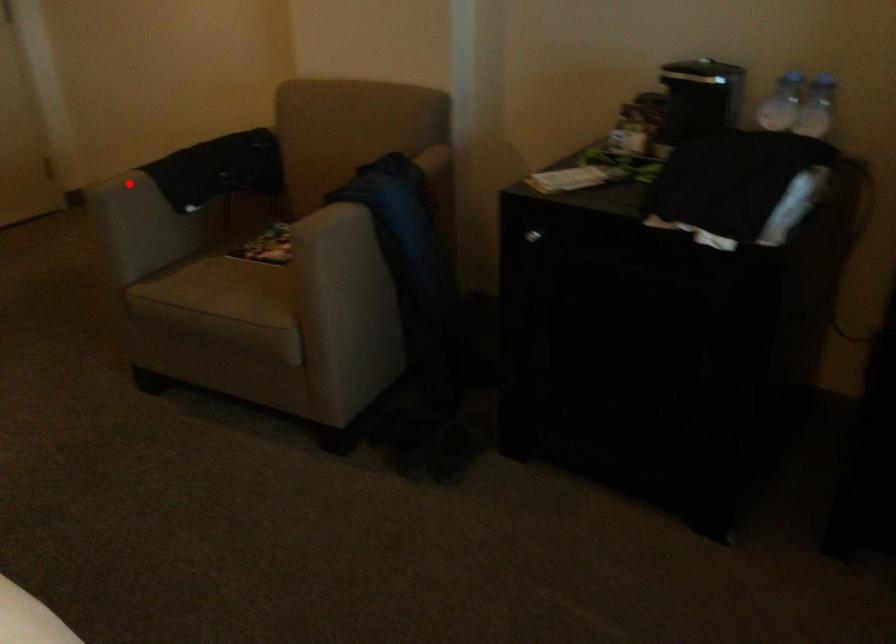
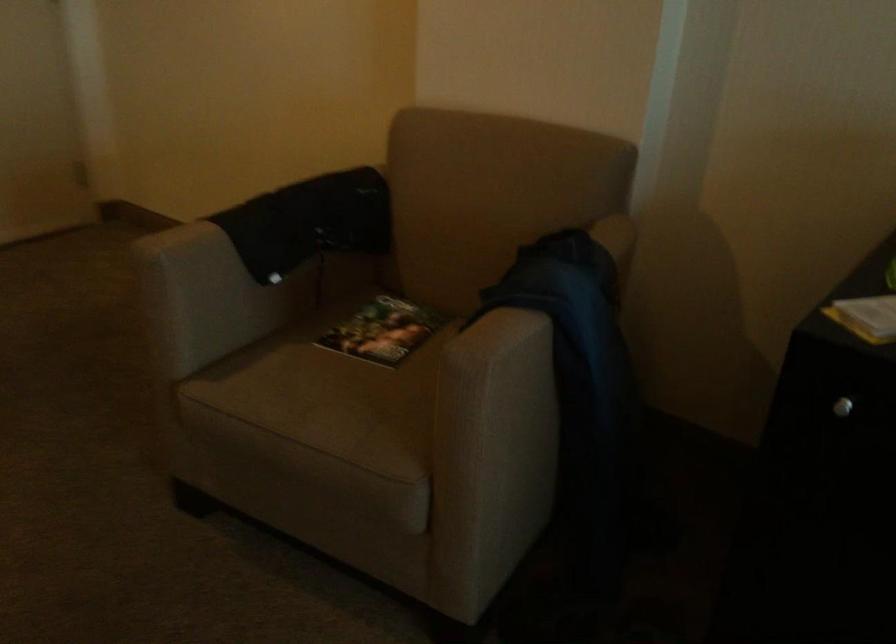
Question: A red point is marked in image1. In image2, is the corresponding 3D point closer to the camera or farther? Reply with the corresponding letter.

Choices:
 (A) The corresponding 3D point is closer.
 (B) The corresponding 3D point is farther.

Answer: (A)